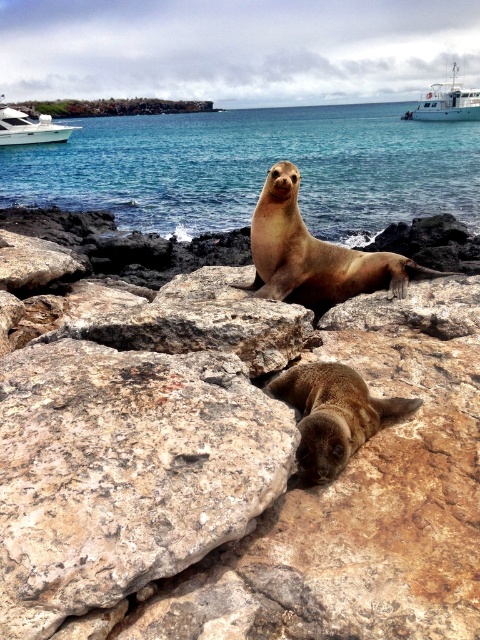
You are a marine biologist observing the coastal scene. You notice the brown rough rock at center and the blue water at center. Which object is located below the other?

The brown rough rock at center is positioned under blue water at center, so the rock is below the water.

What are the coordinates of the brown rough rock at center?

The brown rough rock at center is located at point [232,465].

You are a photographer trying to capture the sea lions on the rocks. You notice the brown rough rock at center and the blue water at center. Which one is shorter in height?

The brown rough rock at center is shorter in height compared to the blue water at center.